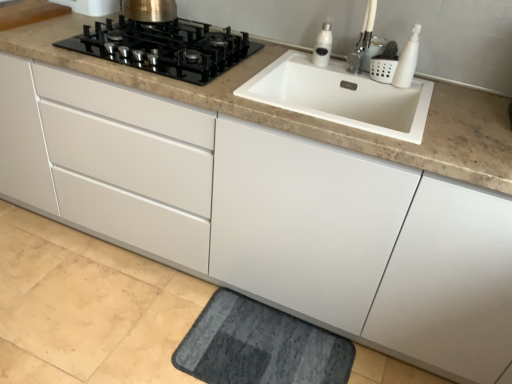
How much space does white glossy soap dispenser at upper right, which appears as the 2th soap dispenser when viewed from the front, occupy horizontally?

3.17 inches.

Where is `white glossy soap dispenser at upper right, the 1th soap dispenser positioned from the left`? The width and height of the screenshot is (512, 384). white glossy soap dispenser at upper right, the 1th soap dispenser positioned from the left is located at coordinates (323, 46).

From the picture: Which object is thinner, dark gray textured bath mat at lower center or white ceramic faucet at upper right?

white ceramic faucet at upper right is thinner.

Is dark gray textured bath mat at lower center taller or shorter than white ceramic faucet at upper right?

dark gray textured bath mat at lower center is shorter than white ceramic faucet at upper right.

From a real-world perspective, is dark gray textured bath mat at lower center above or below white ceramic faucet at upper right?

dark gray textured bath mat at lower center is situated lower than white ceramic faucet at upper right in the real world.

Is point (266, 342) positioned after point (358, 59)?

Yes, it is behind point (358, 59).

Measure the distance between white ceramic faucet at upper right and black glass gas stove at upper left.

white ceramic faucet at upper right and black glass gas stove at upper left are 64.97 centimeters apart from each other.

From a real-world perspective, which object stands above the other?

white ceramic faucet at upper right is physically above.

How many degrees apart are the facing directions of white ceramic faucet at upper right and black glass gas stove at upper left?

There is a 14.1-degree angle between the facing directions of white ceramic faucet at upper right and black glass gas stove at upper left.

Looking at this image, is the position of white ceramic faucet at upper right less distant than that of black glass gas stove at upper left?

Yes, it is in front of black glass gas stove at upper left.

Is dark gray textured bath mat at lower center inside the boundaries of black glass gas stove at upper left, or outside?

dark gray textured bath mat at lower center is located beyond the bounds of black glass gas stove at upper left.

Between point (262, 325) and point (190, 55), which one is positioned behind?

The point (262, 325) is farther from the camera.

From a real-world perspective, is dark gray textured bath mat at lower center physically located above or below black glass gas stove at upper left?

dark gray textured bath mat at lower center is below black glass gas stove at upper left.

Can you tell me how much white glossy soap dispenser at upper right, the 1th soap dispenser positioned from the back, and white ceramic faucet at upper right differ in facing direction?

The angular difference between white glossy soap dispenser at upper right, the 1th soap dispenser positioned from the back, and white ceramic faucet at upper right is 13.2 degrees.

Does point (324, 32) lie behind point (367, 32)?

No.

From the image's perspective, which object appears higher, white glossy soap dispenser at upper right, the second soap dispenser from the right, or white ceramic faucet at upper right?

white glossy soap dispenser at upper right, the second soap dispenser from the right, from the image's perspective.

Between white glossy soap dispenser at upper right, the second soap dispenser from the right, and white ceramic faucet at upper right, which one has smaller width?

white glossy soap dispenser at upper right, the second soap dispenser from the right.

Is black glass gas stove at upper left turned away from white ceramic faucet at upper right?

No.

Considering the sizes of objects black glass gas stove at upper left and white ceramic faucet at upper right in the image provided, who is bigger, black glass gas stove at upper left or white ceramic faucet at upper right?

Bigger between the two is black glass gas stove at upper left.

Which is in front, point (90, 34) or point (369, 23)?

Point (90, 34)

Does black glass gas stove at upper left have a greater width compared to white ceramic faucet at upper right?

Yes.

From the image's perspective, who appears lower, white ceramic faucet at upper right or dark gray textured bath mat at lower center?

dark gray textured bath mat at lower center.

Is white ceramic faucet at upper right facing towards dark gray textured bath mat at lower center?

No, white ceramic faucet at upper right is not turned towards dark gray textured bath mat at lower center.

Between white ceramic faucet at upper right and dark gray textured bath mat at lower center, which one appears on the right side from the viewer's perspective?

From the viewer's perspective, white ceramic faucet at upper right appears more on the right side.

Relative to dark gray textured bath mat at lower center, is white matte soap dispenser at upper right, which is counted as the 1th soap dispenser, starting from the right, in front or behind?

white matte soap dispenser at upper right, which is counted as the 1th soap dispenser, starting from the right, is behind dark gray textured bath mat at lower center.

Is white matte soap dispenser at upper right, which is the 1th soap dispenser from front to back, beside dark gray textured bath mat at lower center?

No, white matte soap dispenser at upper right, which is the 1th soap dispenser from front to back, is not touching dark gray textured bath mat at lower center.

The image size is (512, 384). I want to click on the 1st soap dispenser behind when counting from the dark gray textured bath mat at lower center, so click(407, 61).

This screenshot has width=512, height=384. I want to click on bath mat below the white ceramic faucet at upper right (from the image's perspective), so click(260, 346).

At what (x,y) coordinates should I click in order to perform the action: click on faucet on the right of black glass gas stove at upper left. Please return your answer as a coordinate pair (x, y). This screenshot has width=512, height=384. Looking at the image, I should click on (362, 40).

Estimate the real-world distances between objects in this image. Which object is closer to black glass gas stove at upper left, white glossy soap dispenser at upper right, the second soap dispenser from the right, or white ceramic faucet at upper right?

The object closer to black glass gas stove at upper left is white glossy soap dispenser at upper right, the second soap dispenser from the right.

From the image, which object appears to be nearer to dark gray textured bath mat at lower center, white ceramic faucet at upper right or black glass gas stove at upper left?

black glass gas stove at upper left.

Looking at the image, which one is located closer to white glossy soap dispenser at upper right, which appears as the 2th soap dispenser when viewed from the front, white ceramic faucet at upper right or dark gray textured bath mat at lower center?

white ceramic faucet at upper right lies closer to white glossy soap dispenser at upper right, which appears as the 2th soap dispenser when viewed from the front, than the other object.

Consider the image. Based on their spatial positions, is white ceramic faucet at upper right or black glass gas stove at upper left closer to white matte soap dispenser at upper right, which is the 1th soap dispenser from front to back?

white ceramic faucet at upper right.

Considering their positions, is white matte soap dispenser at upper right, which is the 1th soap dispenser from front to back, positioned further to dark gray textured bath mat at lower center than white ceramic faucet at upper right?

white ceramic faucet at upper right is further to dark gray textured bath mat at lower center.

From the image, which object appears to be farther from dark gray textured bath mat at lower center, white matte soap dispenser at upper right, the 2th soap dispenser when ordered from back to front, or white glossy soap dispenser at upper right, which appears as the 2th soap dispenser when viewed from the front?

Based on the image, white matte soap dispenser at upper right, the 2th soap dispenser when ordered from back to front, appears to be further to dark gray textured bath mat at lower center.

Which object lies nearer to the anchor point white ceramic faucet at upper right, white matte soap dispenser at upper right, which is the 1th soap dispenser from front to back, or black glass gas stove at upper left?

white matte soap dispenser at upper right, which is the 1th soap dispenser from front to back, lies closer to white ceramic faucet at upper right than the other object.

Based on their spatial positions, is white ceramic faucet at upper right or white glossy soap dispenser at upper right, the second soap dispenser from the right, closer to dark gray textured bath mat at lower center?

white glossy soap dispenser at upper right, the second soap dispenser from the right, lies closer to dark gray textured bath mat at lower center than the other object.

You are a GUI agent. You are given a task and a screenshot of the screen. Output one action in this format:
    pyautogui.click(x=<x>, y=<y>)
    Task: Click on the faucet between white glossy soap dispenser at upper right, which appears as the 2th soap dispenser when viewed from the front, and dark gray textured bath mat at lower center from top to bottom
    This screenshot has height=384, width=512.
    Given the screenshot: What is the action you would take?
    pyautogui.click(x=362, y=40)

Where is `faucet between black glass gas stove at upper left and dark gray textured bath mat at lower center in the up-down direction`? This screenshot has height=384, width=512. faucet between black glass gas stove at upper left and dark gray textured bath mat at lower center in the up-down direction is located at coordinates (362, 40).

Find the location of a particular element. This screenshot has width=512, height=384. soap dispenser between white ceramic faucet at upper right and dark gray textured bath mat at lower center in the vertical direction is located at coordinates (407, 61).

Identify the location of soap dispenser between white ceramic faucet at upper right and white glossy soap dispenser at upper right, the 1th soap dispenser positioned from the back, from front to back. The height and width of the screenshot is (384, 512). (407, 61).